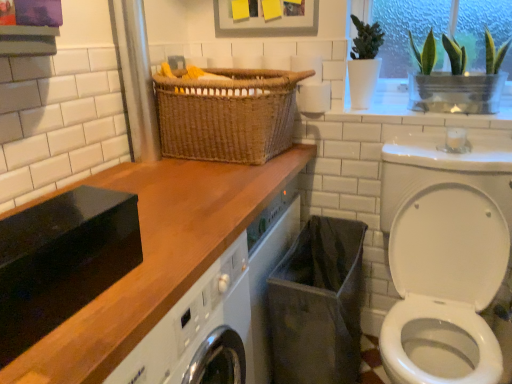
Question: Would you consider black fabric laundry basket at lower center to be distant from green glass vase at upper right?

Choices:
 (A) no
 (B) yes

Answer: (A)

Question: Is black fabric laundry basket at lower center to the right of green glass vase at upper right from the viewer's perspective?

Choices:
 (A) no
 (B) yes

Answer: (A)

Question: From a real-world perspective, is black fabric laundry basket at lower center over green glass vase at upper right?

Choices:
 (A) yes
 (B) no

Answer: (B)

Question: From the image's perspective, is black fabric laundry basket at lower center under green glass vase at upper right?

Choices:
 (A) yes
 (B) no

Answer: (A)

Question: Could green glass vase at upper right be considered to be inside black fabric laundry basket at lower center?

Choices:
 (A) yes
 (B) no

Answer: (B)

Question: Do you think woven brown basket at center is within white glossy washer at lower right, or outside of it?

Choices:
 (A) inside
 (B) outside

Answer: (B)

Question: Relative to white glossy washer at lower right, is woven brown basket at center in front or behind?

Choices:
 (A) behind
 (B) front

Answer: (A)

Question: From a real-world perspective, relative to white glossy washer at lower right, is woven brown basket at center vertically above or below?

Choices:
 (A) above
 (B) below

Answer: (A)

Question: Considering the positions of point (271, 104) and point (410, 367), is point (271, 104) closer or farther from the camera than point (410, 367)?

Choices:
 (A) farther
 (B) closer

Answer: (A)

Question: Is green glass vase at upper right wider or thinner than woven brown basket at center?

Choices:
 (A) wide
 (B) thin

Answer: (B)

Question: Considering the positions of point (415, 48) and point (167, 152), is point (415, 48) closer or farther from the camera than point (167, 152)?

Choices:
 (A) closer
 (B) farther

Answer: (B)

Question: From the image's perspective, relative to woven brown basket at center, is green glass vase at upper right above or below?

Choices:
 (A) below
 (B) above

Answer: (B)

Question: Considering their positions, is green glass vase at upper right located in front of or behind woven brown basket at center?

Choices:
 (A) front
 (B) behind

Answer: (B)

Question: From the image's perspective, is white matte toilet paper at upper center located above or below black fabric laundry basket at lower center?

Choices:
 (A) below
 (B) above

Answer: (B)

Question: Is point (307, 110) closer or farther from the camera than point (358, 294)?

Choices:
 (A) farther
 (B) closer

Answer: (A)